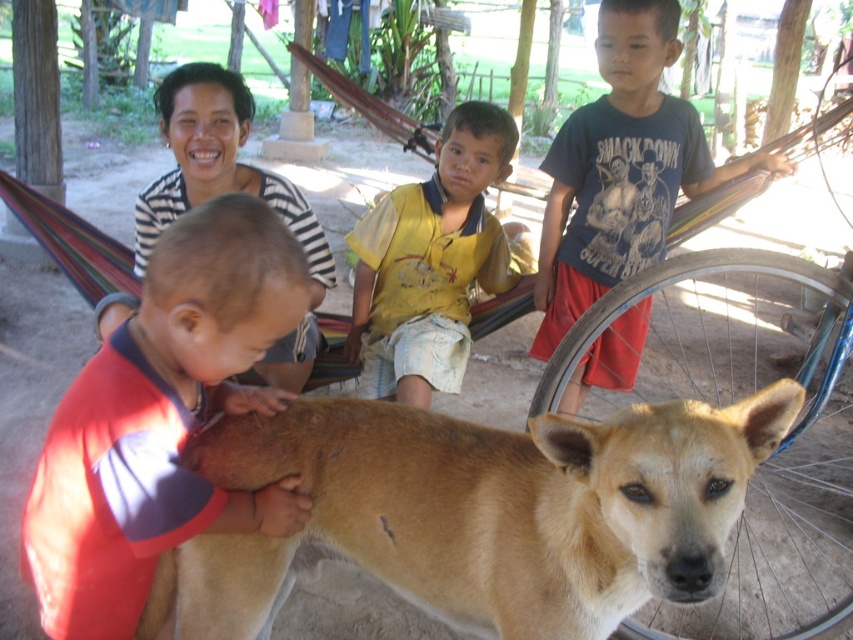
You are trying to decide which item to pick up first between the red cotton shirt at left and the matte brown dog at center. Based on their sizes, which one do you think is easier to handle?

The red cotton shirt at left has a smaller size compared to matte brown dog at center, so it is easier to handle.

You are standing in the scene and notice both the yellow cotton shirt at center and the matte brown dog at center. Which object takes up more space in the image?

The matte brown dog at center takes up more space in the image because it is larger than the yellow cotton shirt at center.